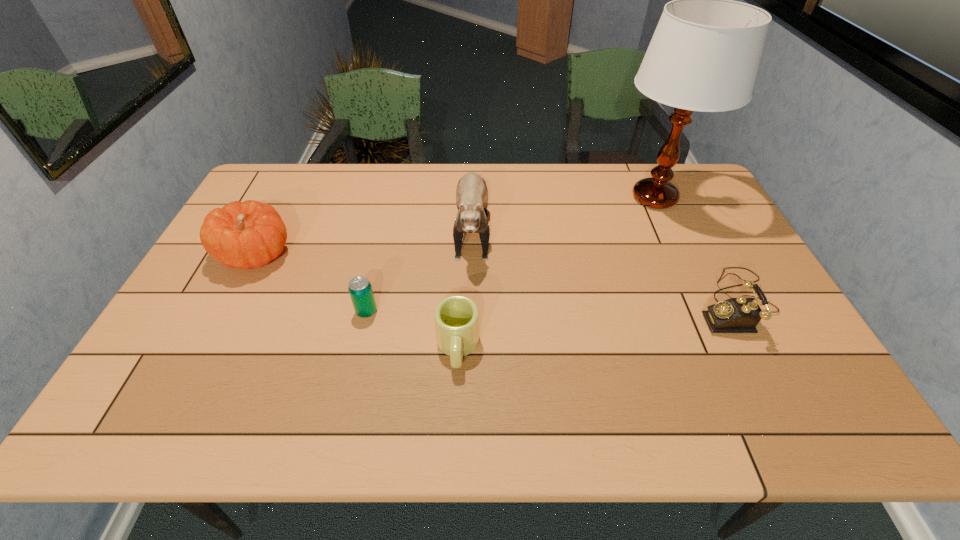
Locate an element on the screen. This screenshot has width=960, height=540. free space located 0.220m on the dial of the telephone is located at coordinates point(612,302).

Where is `free region located on the dial of the telephone`? The height and width of the screenshot is (540, 960). free region located on the dial of the telephone is located at coordinates (635, 302).

Locate an element on the screen. This screenshot has width=960, height=540. blank space located on the dial of the telephone is located at coordinates (x=608, y=302).

The width and height of the screenshot is (960, 540). I want to click on vacant space situated on the right of the second object from left to right, so 432,312.

Where is `free space located with the handle on the side of the mug`? Image resolution: width=960 pixels, height=540 pixels. free space located with the handle on the side of the mug is located at coordinates (455, 415).

At what (x,y) coordinates should I click in order to perform the action: click on table lamp located in the far edge section of the desktop. Please return your answer as a coordinate pair (x, y). Looking at the image, I should click on (704, 55).

In order to click on ferret located at the far edge in this screenshot , I will do `click(471, 194)`.

In order to click on object that is at the left edge in this screenshot , I will do `click(247, 235)`.

The height and width of the screenshot is (540, 960). In order to click on table lamp positioned at the right edge in this screenshot , I will do `click(704, 55)`.

Locate an element on the screen. telephone situated at the right edge is located at coordinates (735, 315).